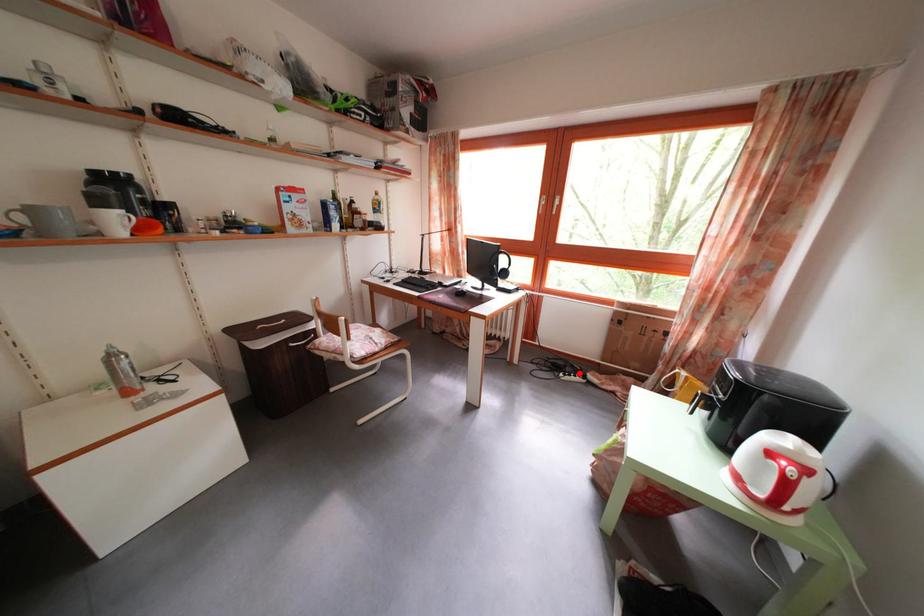
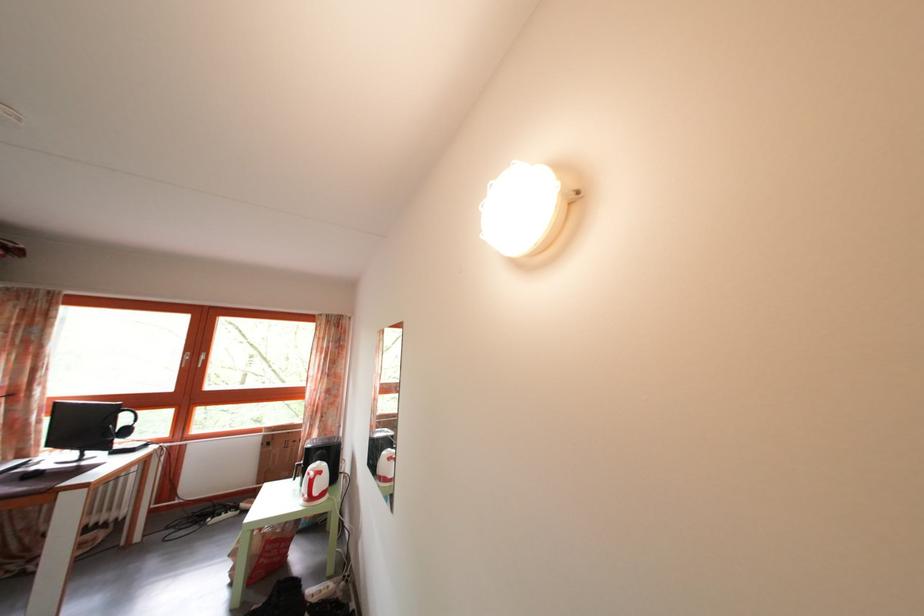
Locate, in the second image, the point that corresponds to the highlighted location in the first image.

(233, 514)